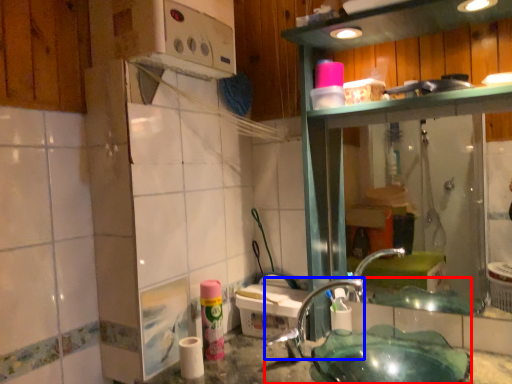
Question: Which object appears farthest to the camera in this image, sink (highlighted by a red box) or faucet (highlighted by a blue box)?

Choices:
 (A) sink
 (B) faucet

Answer: (B)